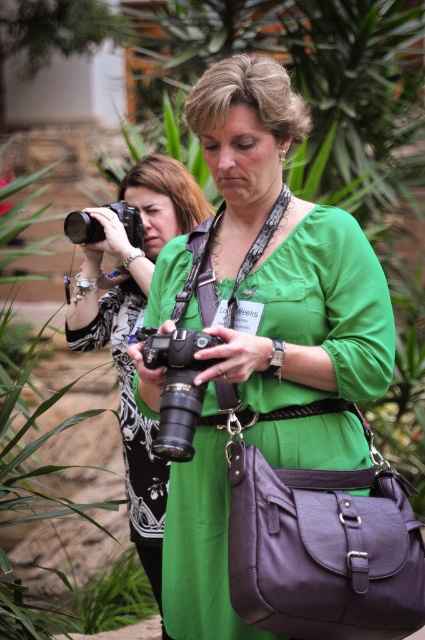
Question: Estimate the real-world distances between objects in this image. Which object is farther from the green matte dress at center?

Choices:
 (A) matte black camera at center
 (B) black plastic camera at center
 (C) black plastic camera at upper left

Answer: (C)

Question: Which object is the closest to the green matte dress at center?

Choices:
 (A) matte black camera at center
 (B) black plastic camera at center
 (C) black plastic camera at upper left
 (D) purple leather bag at lower center

Answer: (D)

Question: Which of these objects is positioned closest to the matte black camera at center?

Choices:
 (A) green matte dress at center
 (B) black plastic camera at center
 (C) black plastic camera at upper left
 (D) purple leather bag at lower center

Answer: (C)

Question: Is green matte dress at center further to the viewer compared to black plastic camera at upper left?

Choices:
 (A) no
 (B) yes

Answer: (A)

Question: Is purple leather bag at lower center in front of black plastic camera at center?

Choices:
 (A) yes
 (B) no

Answer: (A)

Question: Is green matte dress at center smaller than matte black camera at center?

Choices:
 (A) no
 (B) yes

Answer: (B)